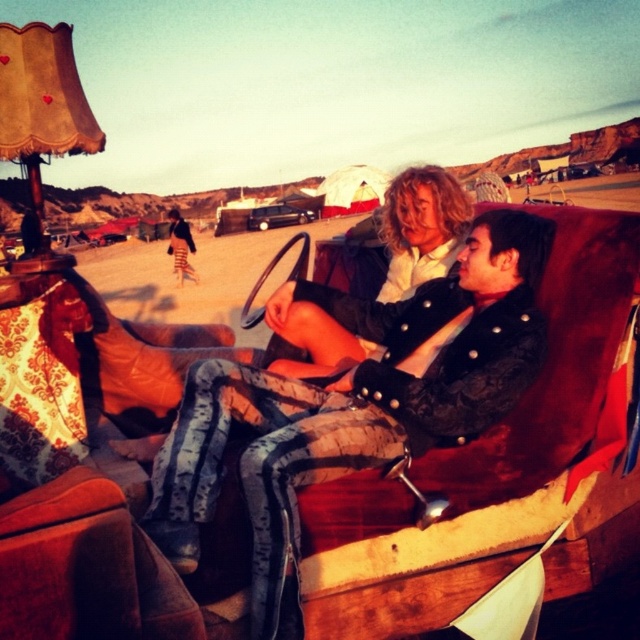
You are a photographer aiming to capture a closeup shot of the black leather jacket at center and the blonde hair at center. Which object is located lower in the image?

The black leather jacket at center is positioned under the blonde hair at center, so it is lower in the image.

You are standing at the origin of a coordinate system placed at the bottom left corner of the image. You see a vintage red couch with two people sitting on it. The person on the left is wearing a white shirt, and the person on the right is wearing a black jacket with silver buttons. There is a point marked at coordinates point (x=353, y=403). Which object is located at this point?

The point at (x=353, y=403) marks the location of the black leather jacket at center.

You are a delivery robot with a 1.5 meter long package. You need to place the package on the ground between you and the black leather jacket at center without moving either. Can you do it?

The distance between you and the black leather jacket at center is 2.08 meters. Since the package is 1.5 meters long, there is enough space to place it between you and the jacket.